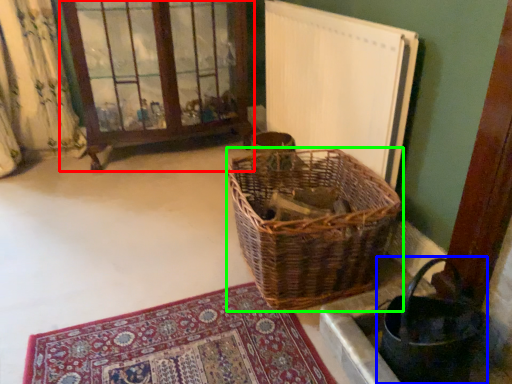
Question: Based on their relative distances, which object is farther from window frame (highlighted by a red box)? Choose from basket (highlighted by a blue box) and picnic basket (highlighted by a green box).

Choices:
 (A) basket
 (B) picnic basket

Answer: (A)